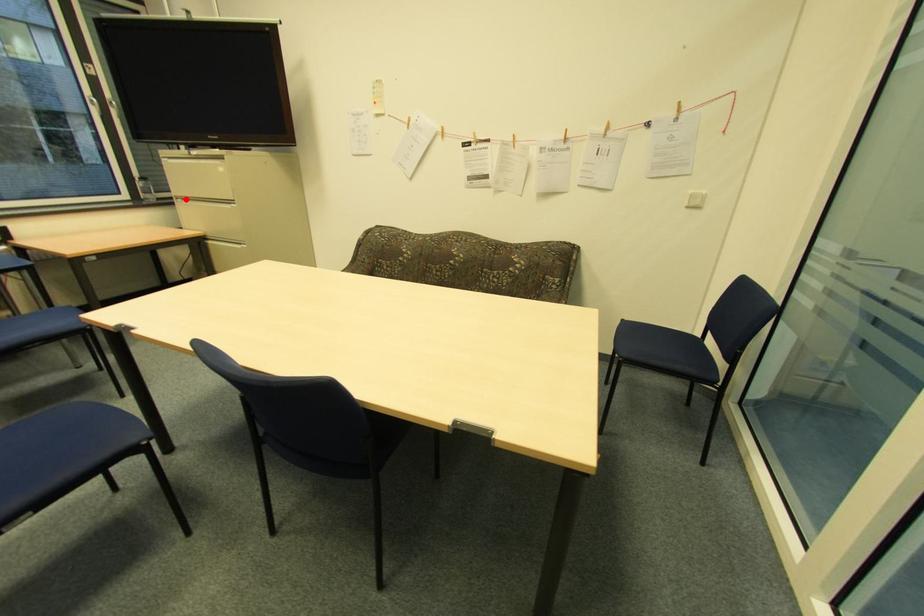
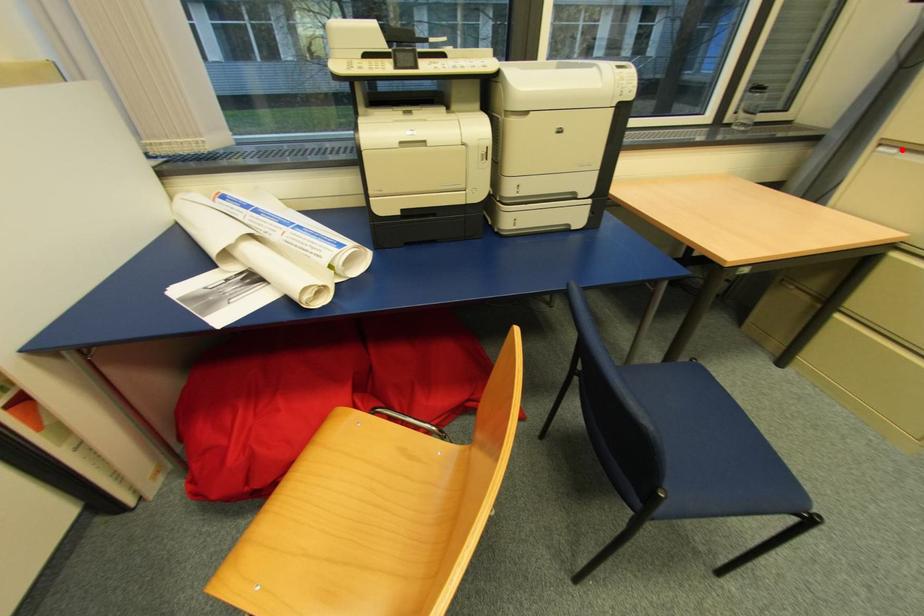
I am providing you with two images of the same scene from different viewpoints. A red point is marked on the first image and another point is marked on the second image. Does the point marked in image1 correspond to the same location as the one in image2?

Yes